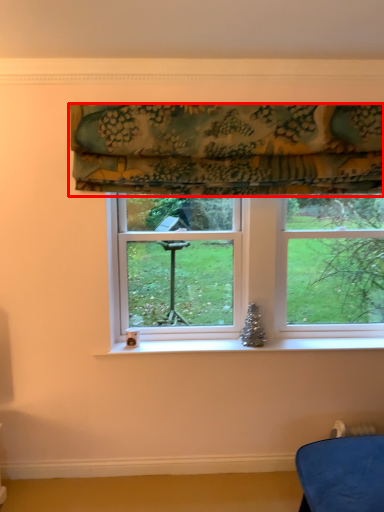
Question: From the image's perspective, where is curtain (annotated by the red box) located relative to window?

Choices:
 (A) above
 (B) below

Answer: (A)